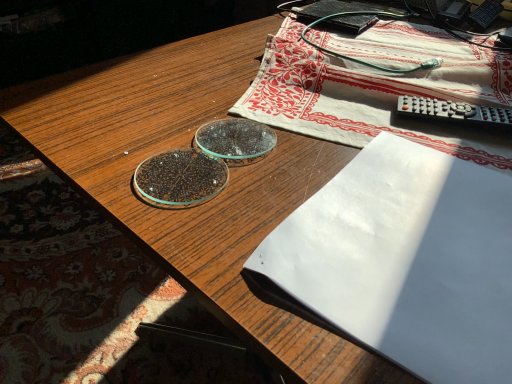
Question: Can you confirm if white paper at center is wider than white cotton tablecloth at upper center?

Choices:
 (A) yes
 (B) no

Answer: (B)

Question: Are white paper at center and white cotton tablecloth at upper center far apart?

Choices:
 (A) yes
 (B) no

Answer: (B)

Question: Is the position of white paper at center less distant than that of white cotton tablecloth at upper center?

Choices:
 (A) yes
 (B) no

Answer: (A)

Question: Does white paper at center have a lesser width compared to white cotton tablecloth at upper center?

Choices:
 (A) no
 (B) yes

Answer: (B)

Question: Is white paper at center at the left side of white cotton tablecloth at upper center?

Choices:
 (A) no
 (B) yes

Answer: (B)

Question: Is white cotton tablecloth at upper center taller or shorter than white paper at center?

Choices:
 (A) tall
 (B) short

Answer: (A)

Question: Considering the positions of white cotton tablecloth at upper center and white paper at center in the image, is white cotton tablecloth at upper center bigger or smaller than white paper at center?

Choices:
 (A) big
 (B) small

Answer: (A)

Question: Would you say white cotton tablecloth at upper center is to the left or to the right of white paper at center in the picture?

Choices:
 (A) right
 (B) left

Answer: (A)

Question: Which is correct: white cotton tablecloth at upper center is inside white paper at center, or outside of it?

Choices:
 (A) outside
 (B) inside

Answer: (A)

Question: Considering the relative positions of white paper at center and black matte paperback book at upper right in the image provided, is white paper at center to the left or to the right of black matte paperback book at upper right?

Choices:
 (A) left
 (B) right

Answer: (A)

Question: Does point (344, 319) appear closer or farther from the camera than point (352, 18)?

Choices:
 (A) closer
 (B) farther

Answer: (A)

Question: From the image's perspective, relative to black matte paperback book at upper right, is white paper at center above or below?

Choices:
 (A) above
 (B) below

Answer: (B)

Question: From a real-world perspective, is white paper at center above or below black matte paperback book at upper right?

Choices:
 (A) above
 (B) below

Answer: (A)

Question: From a real-world perspective, is white paper at center positioned above or below white cotton tablecloth at upper center?

Choices:
 (A) above
 (B) below

Answer: (B)

Question: Looking at their shapes, would you say white paper at center is wider or thinner than white cotton tablecloth at upper center?

Choices:
 (A) wide
 (B) thin

Answer: (B)